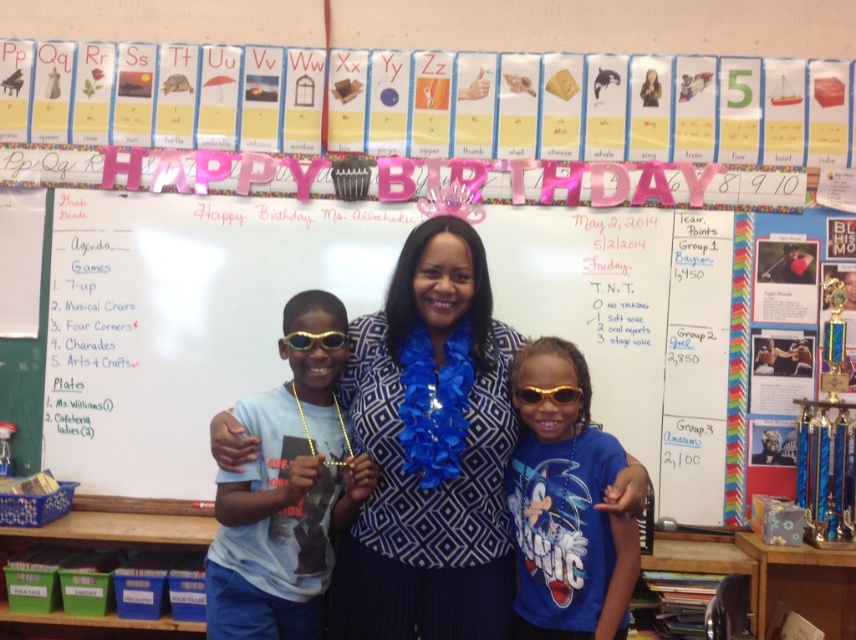
Question: Does gold shiny sunglasses at center appear on the right side of gold shiny goggles at center?

Choices:
 (A) no
 (B) yes

Answer: (B)

Question: Is blue dotted blouse at center smaller than gold shiny sunglasses at center?

Choices:
 (A) yes
 (B) no

Answer: (B)

Question: Among these points, which one is nearest to the camera?

Choices:
 (A) (408, 237)
 (B) (515, 397)
 (C) (92, 385)
 (D) (634, 528)

Answer: (D)

Question: Which object appears closest to the camera in this image?

Choices:
 (A) whiteboard at center
 (B) light blue t-shirt at center

Answer: (B)

Question: In this image, where is whiteboard at center located relative to light blue t-shirt at center?

Choices:
 (A) right
 (B) left

Answer: (B)

Question: Among these objects, which one is farthest from the camera?

Choices:
 (A) light blue t-shirt at center
 (B) gold shiny goggles at center

Answer: (B)